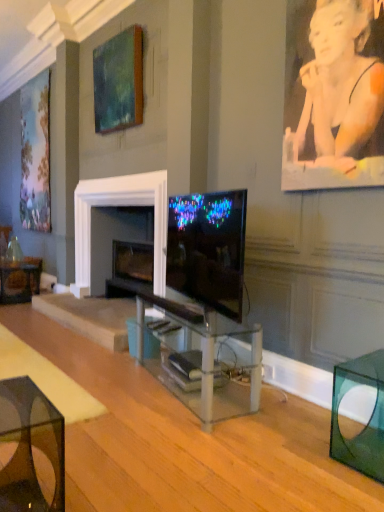
What are the coordinates of `free space underneath smooth skin portrait at upper right (from a real-world perspective)` in the screenshot? It's located at [313, 398].